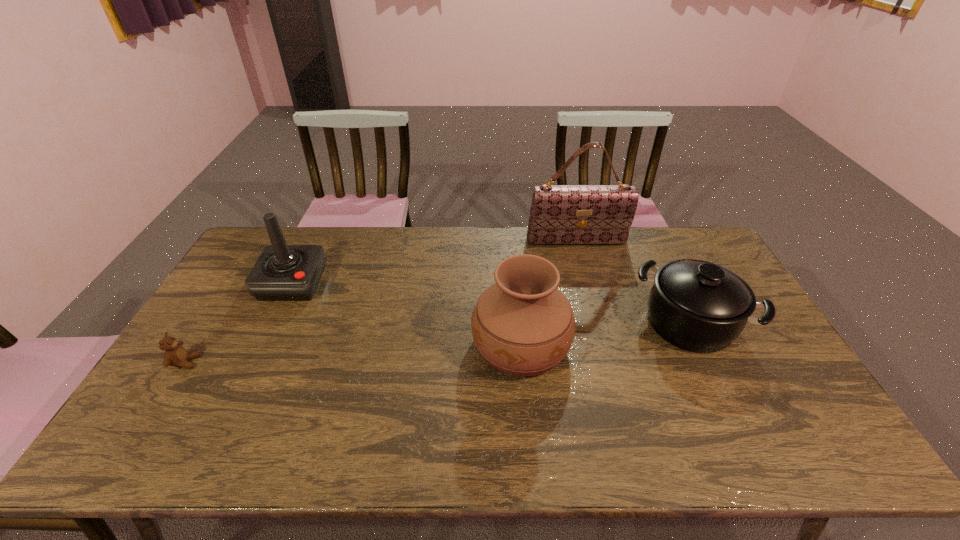
Locate an element on the screen. This screenshot has height=540, width=960. vacant point located 0.250m on the back of the saucepan is located at coordinates (652, 246).

Locate an element on the screen. Image resolution: width=960 pixels, height=540 pixels. vacant space located at the face of the shortest object is located at coordinates (325, 362).

Where is `handbag that is positioned at the far edge`? handbag that is positioned at the far edge is located at coordinates (560, 214).

Image resolution: width=960 pixels, height=540 pixels. I want to click on joystick positioned at the far edge, so click(x=282, y=272).

This screenshot has width=960, height=540. Find the location of `joystick present at the left edge`. joystick present at the left edge is located at coordinates (282, 272).

Locate an element on the screen. teddy bear situated at the left edge is located at coordinates (175, 355).

Find the location of a particular element. The height and width of the screenshot is (540, 960). object present at the right edge is located at coordinates (698, 306).

This screenshot has height=540, width=960. Identify the location of object located in the far left corner section of the desktop. (282, 272).

Locate an element on the screen. vacant space at the far edge is located at coordinates (567, 245).

Where is `free location at the near edge`? The width and height of the screenshot is (960, 540). free location at the near edge is located at coordinates (666, 434).